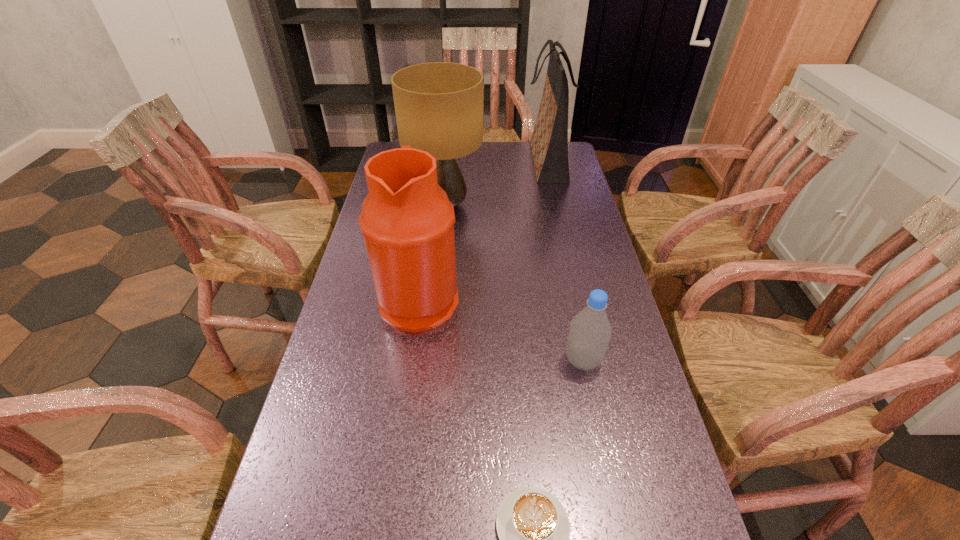
The image size is (960, 540). I want to click on free space located 0.240m on the front of the fourth tallest object, so click(609, 485).

Find the location of a particular element. Image resolution: width=960 pixels, height=540 pixels. object located at the far edge is located at coordinates (549, 143).

Identify the location of lampshade at the left edge. The width and height of the screenshot is (960, 540). (439, 105).

This screenshot has width=960, height=540. Identify the location of water jug that is at the left edge. (407, 220).

Locate an element on the screen. shopping bag located in the right edge section of the desktop is located at coordinates (549, 143).

Locate an element on the screen. bottle that is at the right edge is located at coordinates (590, 331).

You are a GUI agent. You are given a task and a screenshot of the screen. Output one action in this format:
    pyautogui.click(x=<x>, y=<y>)
    Task: Click on the object that is positioned at the far right corner
    The height and width of the screenshot is (540, 960).
    Given the screenshot: What is the action you would take?
    pyautogui.click(x=549, y=143)

Locate an element on the screen. free space at the far edge of the desktop is located at coordinates (x=529, y=147).

Locate an element on the screen. The image size is (960, 540). free space at the left edge of the desktop is located at coordinates (353, 502).

This screenshot has height=540, width=960. Identify the location of vacant space at the right edge of the desktop. (547, 200).